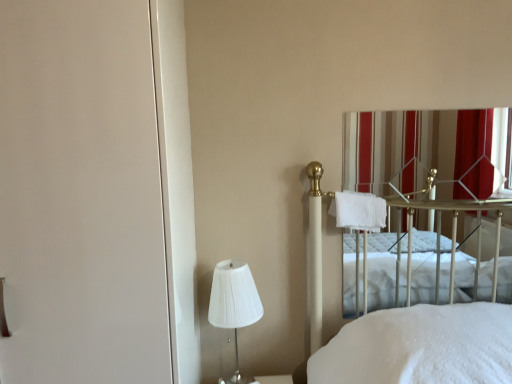
Question: Is white pleated fabric lampshade at lower left located within white matte screen door at left?

Choices:
 (A) yes
 (B) no

Answer: (B)

Question: Does white matte screen door at left have a lesser height compared to white pleated fabric lampshade at lower left?

Choices:
 (A) yes
 (B) no

Answer: (B)

Question: Does white matte screen door at left have a smaller size compared to white pleated fabric lampshade at lower left?

Choices:
 (A) yes
 (B) no

Answer: (B)

Question: From a real-world perspective, is white matte screen door at left positioned over white pleated fabric lampshade at lower left based on gravity?

Choices:
 (A) yes
 (B) no

Answer: (A)

Question: From the image's perspective, is white matte screen door at left on white pleated fabric lampshade at lower left?

Choices:
 (A) no
 (B) yes

Answer: (B)

Question: Is there a large distance between white matte screen door at left and white pleated fabric lampshade at lower left?

Choices:
 (A) yes
 (B) no

Answer: (B)

Question: Considering the relative positions of white soft towel at center-right and white matte screen door at left in the image provided, is white soft towel at center-right behind white matte screen door at left?

Choices:
 (A) yes
 (B) no

Answer: (A)

Question: Is white soft towel at center-right positioned in front of white matte screen door at left?

Choices:
 (A) yes
 (B) no

Answer: (B)

Question: Is white soft towel at center-right placed right next to white matte screen door at left?

Choices:
 (A) yes
 (B) no

Answer: (B)

Question: Is white soft towel at center-right smaller than white matte screen door at left?

Choices:
 (A) yes
 (B) no

Answer: (A)

Question: Does white soft towel at center-right appear on the right side of white matte screen door at left?

Choices:
 (A) no
 (B) yes

Answer: (B)

Question: Are white soft towel at center-right and white matte screen door at left far apart?

Choices:
 (A) no
 (B) yes

Answer: (B)

Question: Is white pleated fabric lampshade at lower left oriented away from white soft towel at center-right?

Choices:
 (A) yes
 (B) no

Answer: (B)